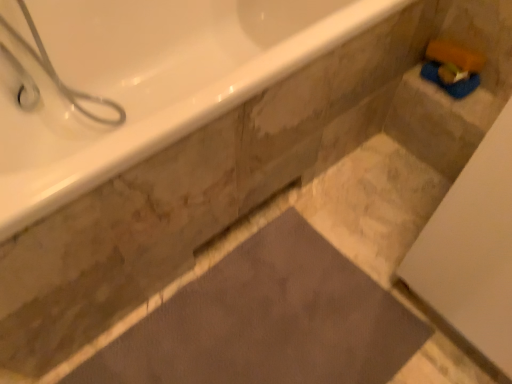
Identify the location of free point above dark gray matte bath mat at center (from a real-world perspective). (256, 332).